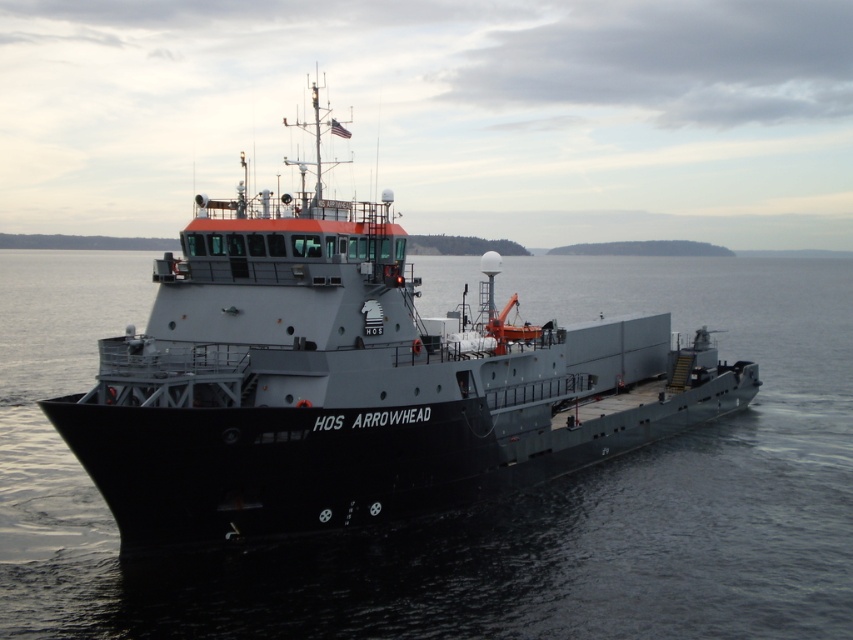
You are a sailor on the HOS Arrowhead and you need to secure a new antenna on the deck. You see the black matte water at center and the black matte ship at center. Which object is closer to you as you stand on the deck?

The black matte water at center is in front of the black matte ship at center, so it is closer to you as you stand on the deck.